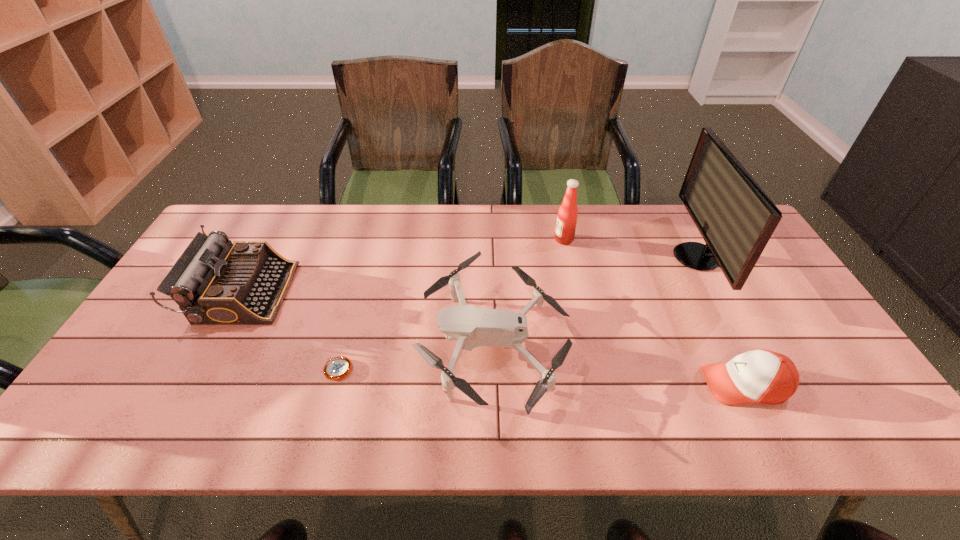
Find the location of a particular element. This screenshot has width=960, height=540. computer monitor is located at coordinates (735, 217).

Identify the location of the fourth object from left to right. (567, 216).

Locate an element on the screen. The height and width of the screenshot is (540, 960). condiment is located at coordinates (567, 216).

Locate an element on the screen. The height and width of the screenshot is (540, 960). the third tallest object is located at coordinates (214, 282).

Where is `the leftmost object`? the leftmost object is located at coordinates (214, 282).

At what (x,y) coordinates should I click in order to perform the action: click on drone. Please return your answer as a coordinate pair (x, y). The width and height of the screenshot is (960, 540). Looking at the image, I should click on (473, 327).

Identify the location of baseball cap. This screenshot has height=540, width=960. (763, 376).

You are a GUI agent. You are given a task and a screenshot of the screen. Output one action in this format:
    pyautogui.click(x=<x>, y=<y>)
    Task: Click on the shortest object
    
    Given the screenshot: What is the action you would take?
    click(x=336, y=368)

The width and height of the screenshot is (960, 540). In order to click on the second object from left to right in this screenshot , I will do `click(336, 368)`.

Locate an element on the screen. Image resolution: width=960 pixels, height=540 pixels. vacant space located 0.390m on the front-facing side of the computer monitor is located at coordinates 550,257.